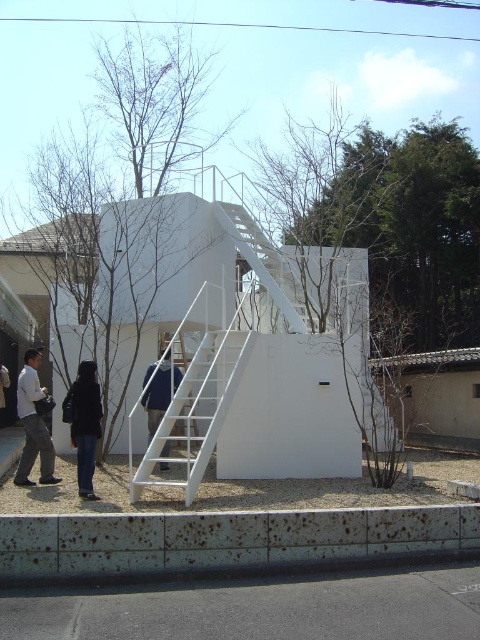
Can you confirm if light brown leather jacket at lower left is positioned below dark blue jeans at lower center?

No, light brown leather jacket at lower left is not below dark blue jeans at lower center.

Who is more distant from viewer, (35, 358) or (84, 452)?

The point (35, 358) is more distant.

Where is `light brown leather jacket at lower left`? The image size is (480, 640). light brown leather jacket at lower left is located at coordinates click(x=34, y=424).

Is point (95, 420) closer to camera compared to point (144, 400)?

That is True.

Is dark blue jeans at lower center shorter than blue fabric jacket at center?

Incorrect, dark blue jeans at lower center's height does not fall short of blue fabric jacket at center's.

What do you see at coordinates (84, 422) in the screenshot? The height and width of the screenshot is (640, 480). I see `dark blue jeans at lower center` at bounding box center [84, 422].

Where is `dark blue jeans at lower center`? This screenshot has width=480, height=640. dark blue jeans at lower center is located at coordinates (84, 422).

Is white matte staircase at center in front of dark blue jeans at lower center?

That is False.

Who is positioned more to the left, white matte staircase at center or dark blue jeans at lower center?

dark blue jeans at lower center

Is point (188, 314) closer to camera compared to point (80, 492)?

No, it is behind (80, 492).

Image resolution: width=480 pixels, height=640 pixels. I want to click on white matte staircase at center, so click(200, 404).